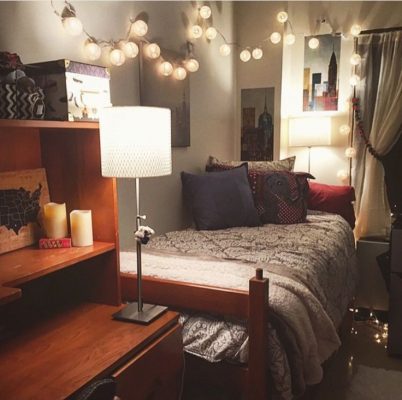
What are the coordinates of `bed` in the screenshot? It's located at (267, 247).